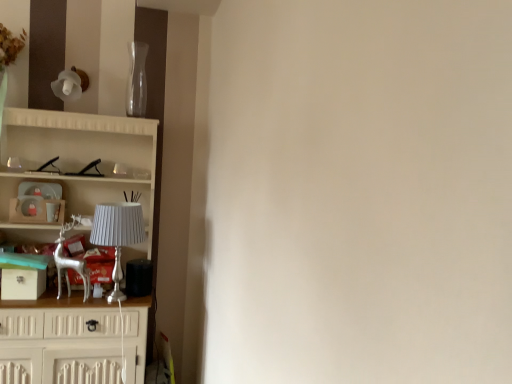
Question: Does transparent glass vase at upper center have a smaller size compared to silver metallic deer at left?

Choices:
 (A) no
 (B) yes

Answer: (B)

Question: Considering the relative sizes of transparent glass vase at upper center and silver metallic deer at left in the image provided, is transparent glass vase at upper center bigger than silver metallic deer at left?

Choices:
 (A) no
 (B) yes

Answer: (A)

Question: Are transparent glass vase at upper center and silver metallic deer at left making contact?

Choices:
 (A) yes
 (B) no

Answer: (B)

Question: Considering the relative sizes of transparent glass vase at upper center and silver metallic deer at left in the image provided, is transparent glass vase at upper center wider than silver metallic deer at left?

Choices:
 (A) yes
 (B) no

Answer: (B)

Question: From a real-world perspective, is transparent glass vase at upper center on top of silver metallic deer at left?

Choices:
 (A) yes
 (B) no

Answer: (A)

Question: Can you confirm if transparent glass vase at upper center is positioned to the left of silver metallic deer at left?

Choices:
 (A) no
 (B) yes

Answer: (A)

Question: From a real-world perspective, is white wooden cupboard at left positioned over silver metallic deer at left based on gravity?

Choices:
 (A) no
 (B) yes

Answer: (A)

Question: From the image's perspective, is white wooden cupboard at left under silver metallic deer at left?

Choices:
 (A) no
 (B) yes

Answer: (B)

Question: Are white wooden cupboard at left and silver metallic deer at left far apart?

Choices:
 (A) no
 (B) yes

Answer: (A)

Question: Are white wooden cupboard at left and silver metallic deer at left beside each other?

Choices:
 (A) no
 (B) yes

Answer: (A)

Question: Can you confirm if white wooden cupboard at left is bigger than silver metallic deer at left?

Choices:
 (A) no
 (B) yes

Answer: (B)

Question: Considering the relative sizes of white wooden cupboard at left and silver metallic deer at left in the image provided, is white wooden cupboard at left smaller than silver metallic deer at left?

Choices:
 (A) no
 (B) yes

Answer: (A)

Question: Is silver metallic lamp at left looking in the opposite direction of transparent glass vase at upper center?

Choices:
 (A) yes
 (B) no

Answer: (B)